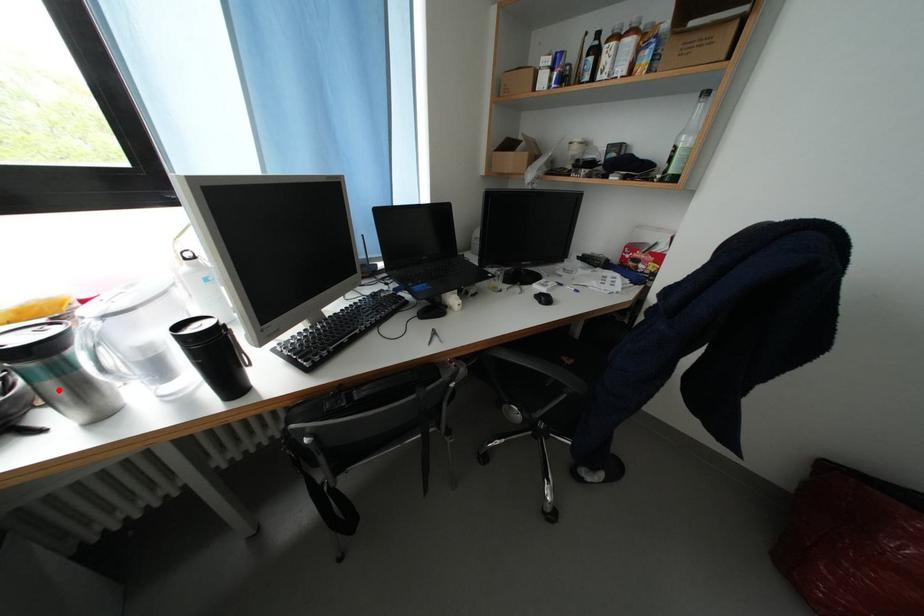
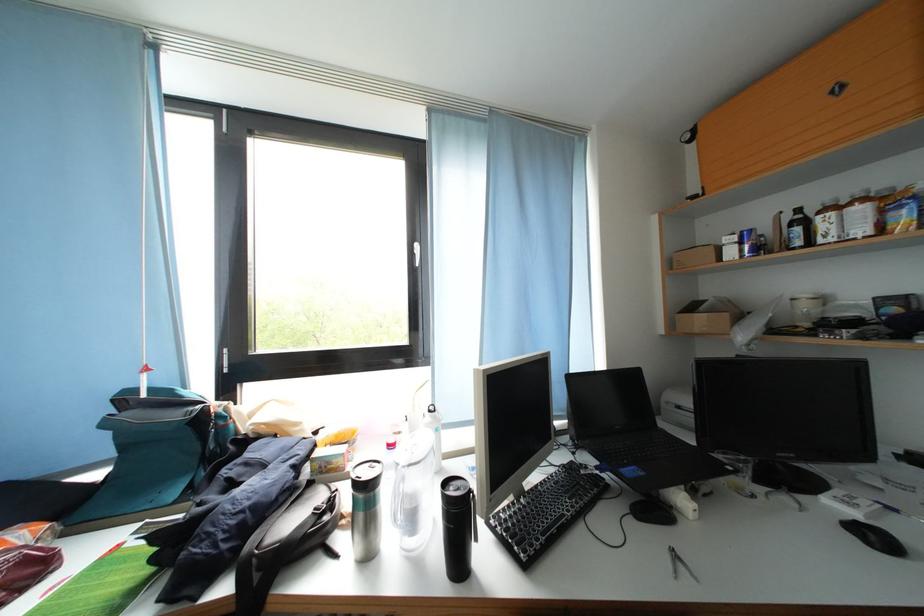
Locate, in the second image, the point that corresponds to the highlighted location in the first image.

(369, 521)